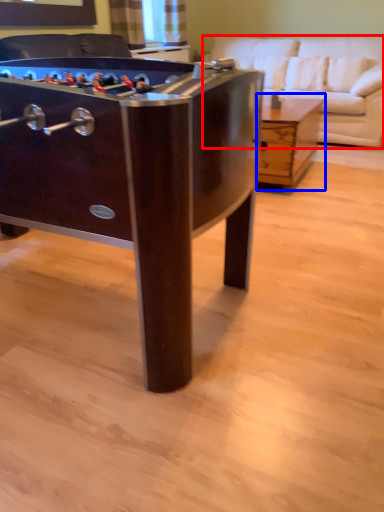
Question: Which point is closer to the camera, studio couch (highlighted by a red box) or table (highlighted by a blue box)?

Choices:
 (A) studio couch
 (B) table

Answer: (B)